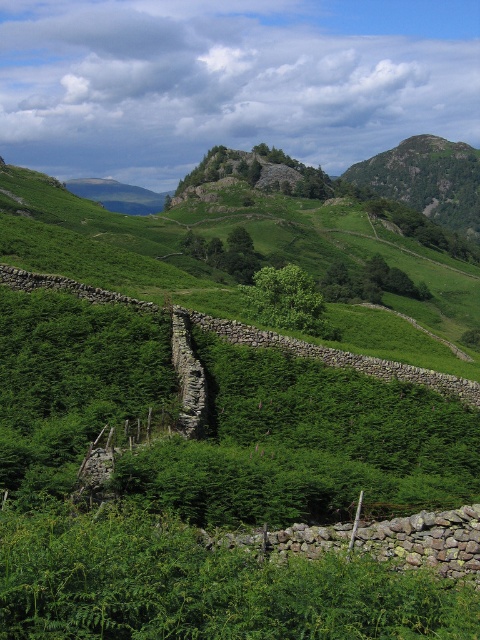
Between point (201, 310) and point (475, 150), which one is positioned in front?

Point (201, 310) is in front.

Is green grassy hillside at center thinner than rugged rock mountain at upper center?

No.

Identify the location of green grassy hillside at center. The height and width of the screenshot is (640, 480). (105, 246).

Locate an element on the screen. green grassy hillside at center is located at coordinates (105, 246).